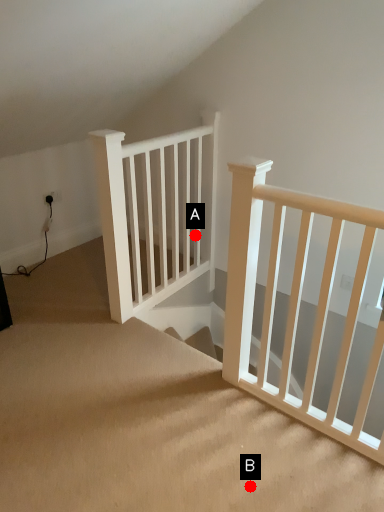
Question: Two points are circled on the image, labeled by A and B beside each circle. Which point is closer to the camera taking this photo?

Choices:
 (A) A is closer
 (B) B is closer

Answer: (B)